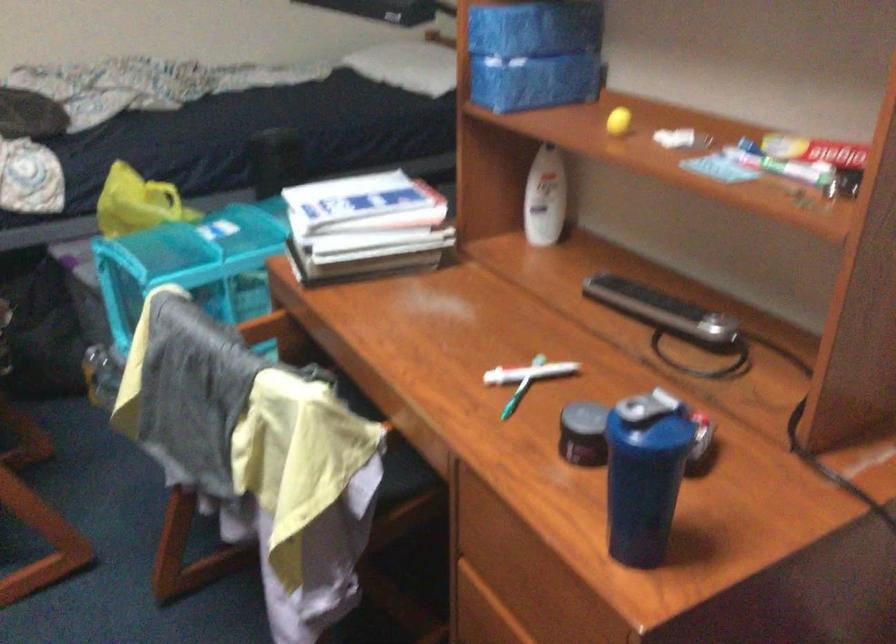
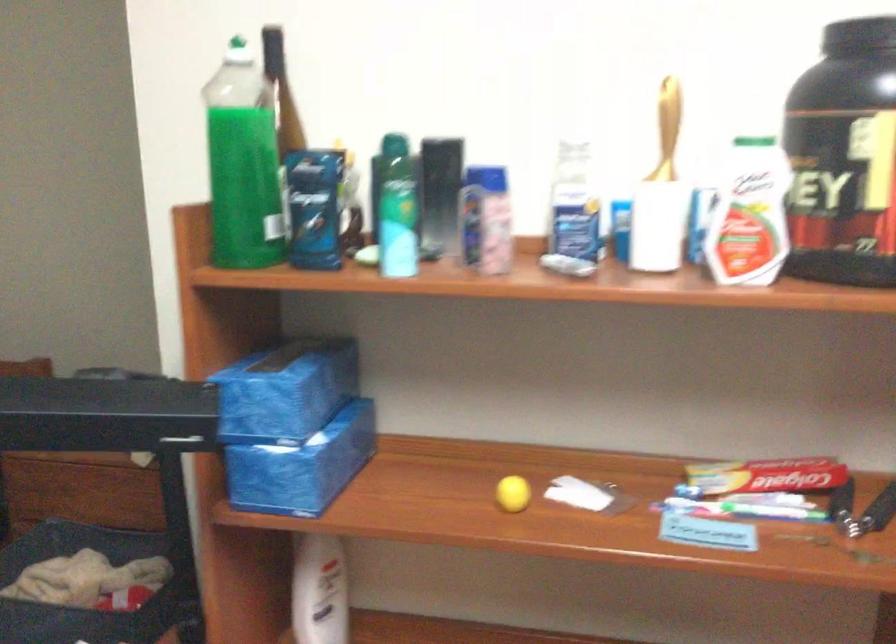
Where in the second image is the point corresponding to point (492, 82) from the first image?

(288, 478)